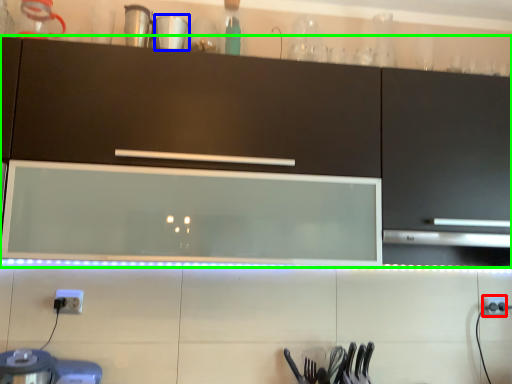
Question: Considering the real-world distances, which object is farthest from electric outlet (highlighted by a red box)? tableware (highlighted by a blue box) or cabinetry (highlighted by a green box)?

Choices:
 (A) tableware
 (B) cabinetry

Answer: (A)